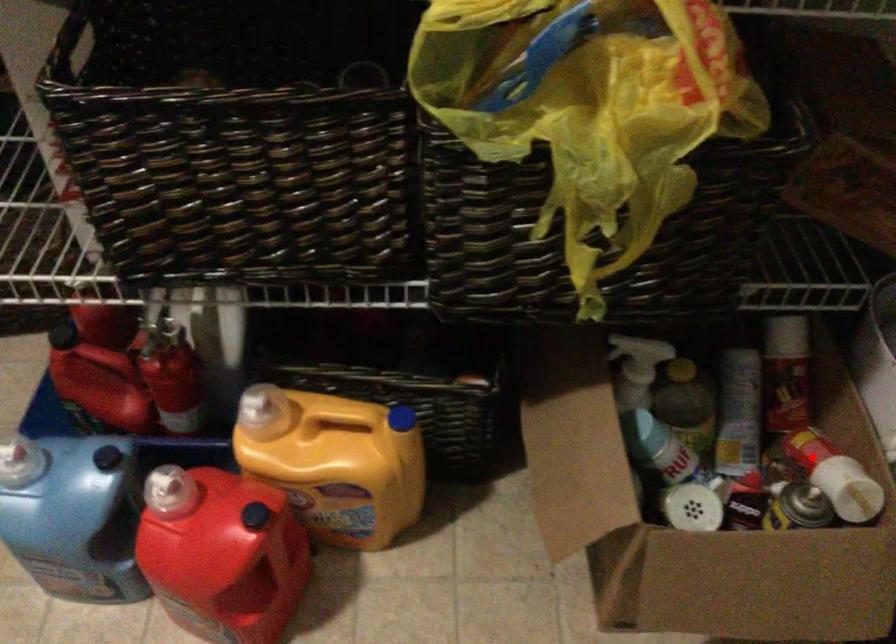
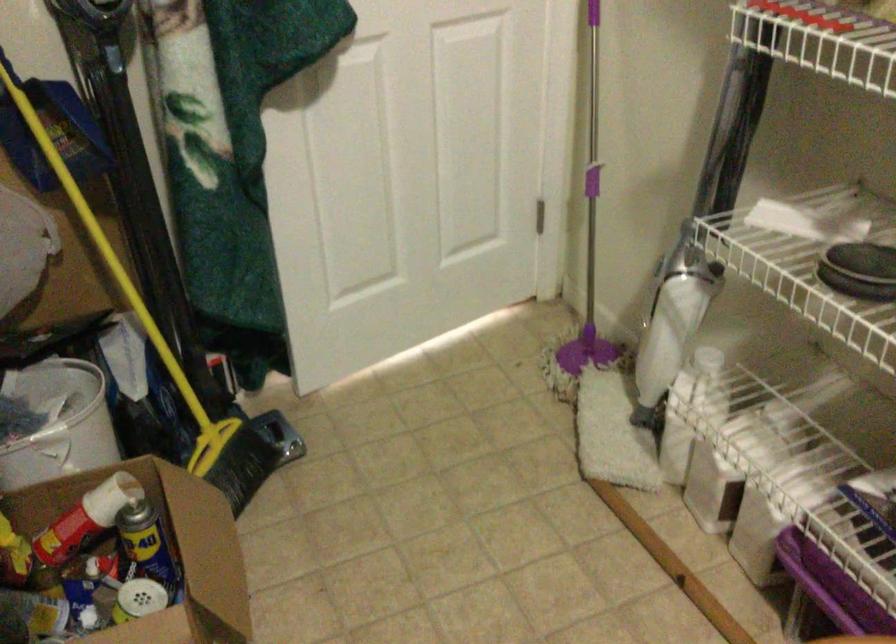
Question: I am providing you with two images of the same scene from different viewpoints. Given a red point in image1, look at the same physical point in image2. Is it:

Choices:
 (A) Closer to the viewpoint
 (B) Farther from the viewpoint

Answer: (B)